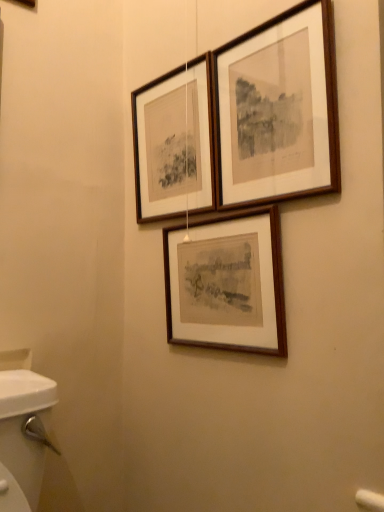
Question: Based on their positions, is wooden frame at center, positioned as the first picture frame in bottom-to-top order, located to the left or right of wooden frame at upper center, which ranks as the second picture frame in top-to-bottom order?

Choices:
 (A) left
 (B) right

Answer: (B)

Question: From the image's perspective, relative to wooden frame at upper center, the 2th picture frame ordered from the bottom, is wooden frame at center, which is the third picture frame in top-to-bottom order, above or below?

Choices:
 (A) above
 (B) below

Answer: (B)

Question: Estimate the real-world distances between objects in this image. Which object is farther from the wooden frame at upper center, the 2th picture frame ordered from the bottom?

Choices:
 (A) wooden picture frame at upper center, the 1th picture frame when ordered from top to bottom
 (B) wooden frame at center, positioned as the first picture frame in bottom-to-top order

Answer: (B)

Question: Based on their relative distances, which object is farther from the wooden frame at upper center, the 2th picture frame ordered from the bottom?

Choices:
 (A) wooden frame at center, which is the third picture frame in top-to-bottom order
 (B) wooden picture frame at upper center, the 1th picture frame when ordered from top to bottom

Answer: (A)